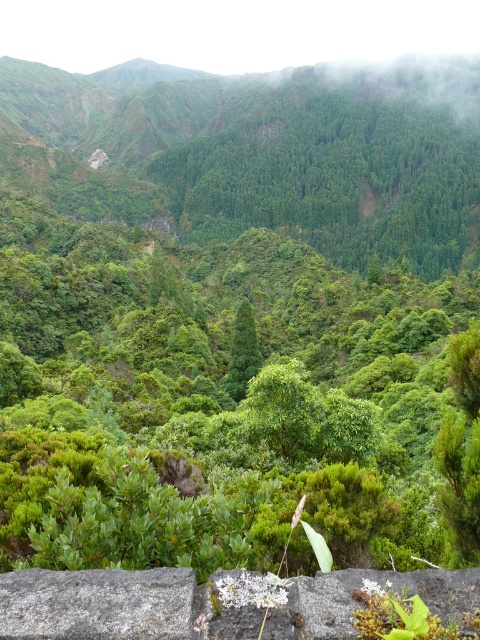
You are standing at the center of the rocky ledge in the foreground of the image. You want to place a small garden ornament exactly at the location of the green leafy shrub at center. What are the coordinates where you should place it?

The green leafy shrub at center is located at coordinates point [224,397]. You should place the garden ornament at point [224,397].

You are a hiker who wants to sit down for a rest. You see a green leafy shrub at center and a gray rough stone at lower left. Which object would be a better place to sit on?

The gray rough stone at lower left is a better place to sit on because the green leafy shrub at center is bigger, but sitting on a shrub might damage the plant. The stone provides a solid surface for resting without harming the environment.